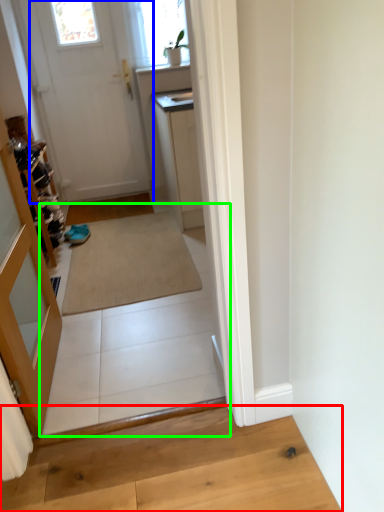
Question: Which is nearer to the hardwood (highlighted by a red box)? door (highlighted by a blue box) or path (highlighted by a green box).

Choices:
 (A) door
 (B) path

Answer: (B)